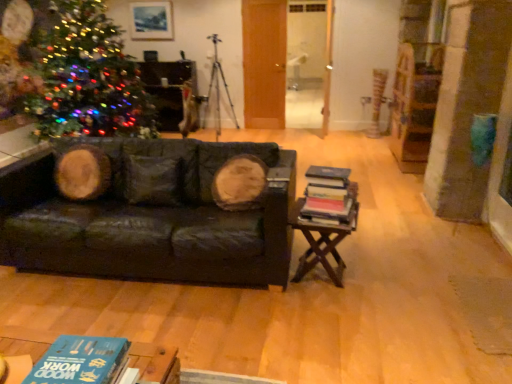
This screenshot has width=512, height=384. Identify the location of free space in front of wooden at right. (330, 311).